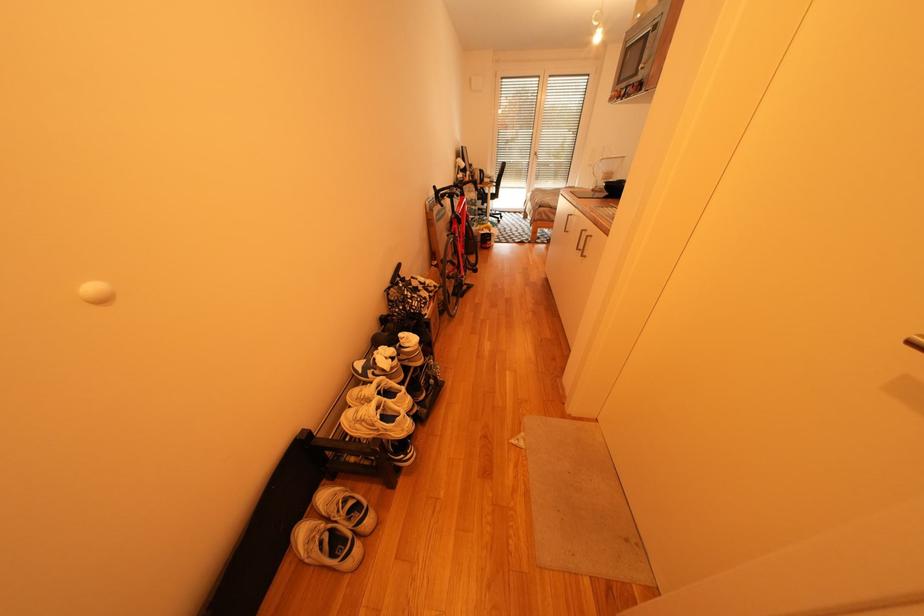
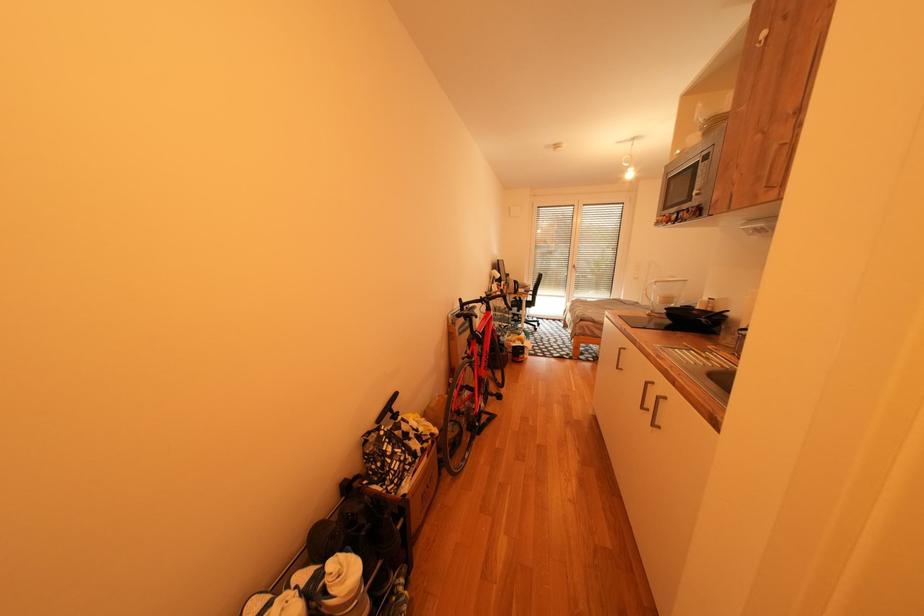
Question: How did the camera likely rotate?

Choices:
 (A) Left
 (B) Right
 (C) Up
 (D) Down

Answer: (C)